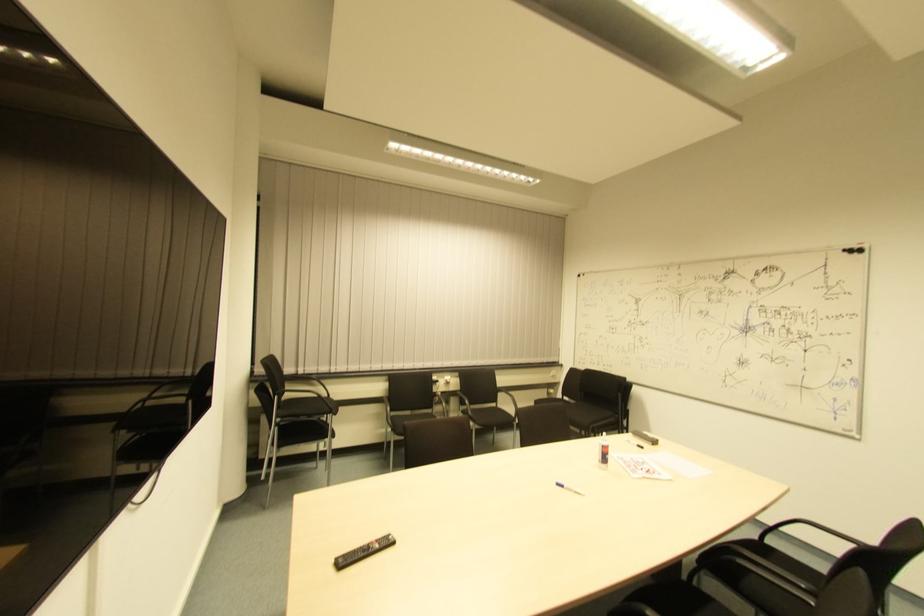
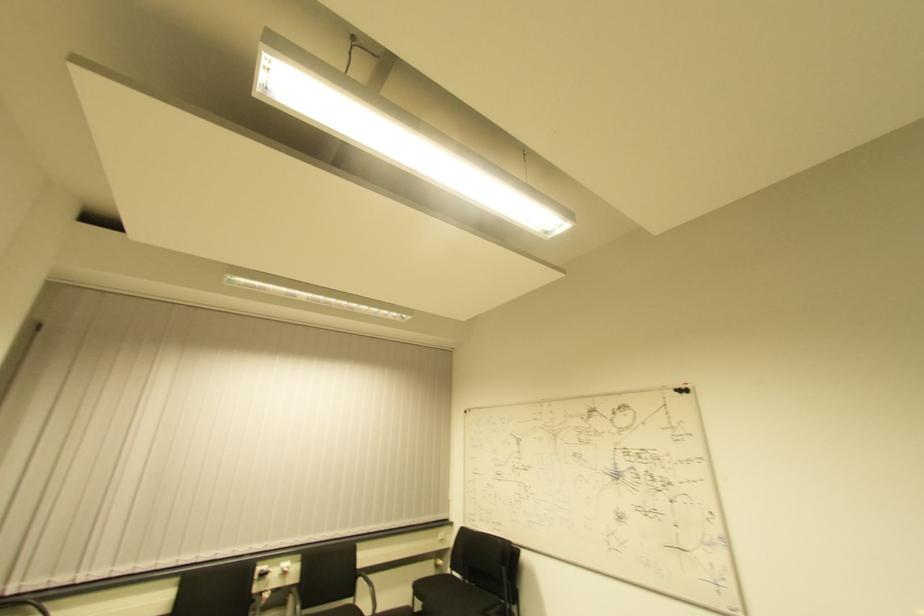
Find the pixel in the second image that matches point 315,381 in the first image.

(37, 601)